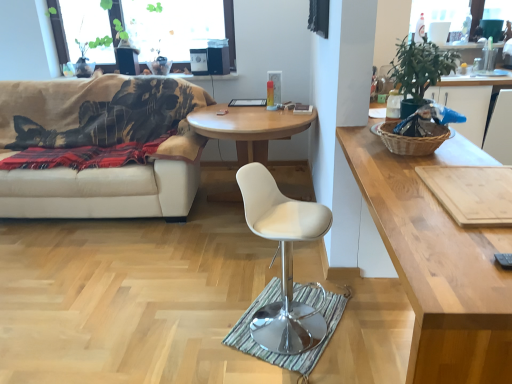
Identify the location of free point below wooden cutting board at right (from a real-world perspective). (477, 188).